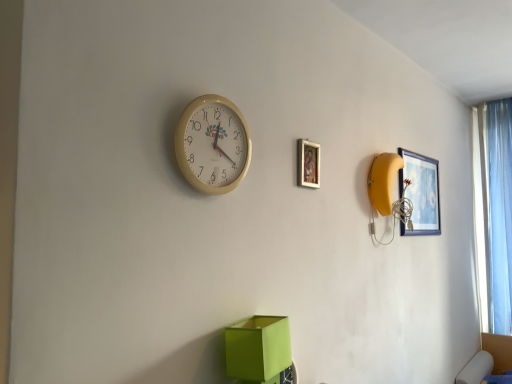
Question: Does wooden picture frame at upper center, the 2th picture frame positioned from the right, appear on the left side of light blue sheer curtain at right?

Choices:
 (A) yes
 (B) no

Answer: (A)

Question: Considering the relative sizes of wooden picture frame at upper center, marked as the 1th picture frame in a front-to-back arrangement, and light blue sheer curtain at right in the image provided, is wooden picture frame at upper center, marked as the 1th picture frame in a front-to-back arrangement, shorter than light blue sheer curtain at right?

Choices:
 (A) no
 (B) yes

Answer: (B)

Question: Considering the relative sizes of wooden picture frame at upper center, marked as the 1th picture frame in a left-to-right arrangement, and light blue sheer curtain at right in the image provided, is wooden picture frame at upper center, marked as the 1th picture frame in a left-to-right arrangement, taller than light blue sheer curtain at right?

Choices:
 (A) no
 (B) yes

Answer: (A)

Question: From a real-world perspective, does wooden picture frame at upper center, the 2th picture frame positioned from the right, sit lower than light blue sheer curtain at right?

Choices:
 (A) no
 (B) yes

Answer: (A)

Question: Is wooden picture frame at upper center, marked as the 1th picture frame in a left-to-right arrangement, positioned beyond the bounds of light blue sheer curtain at right?

Choices:
 (A) no
 (B) yes

Answer: (B)

Question: Is wooden picture frame at upper center, marked as the 1th picture frame in a front-to-back arrangement, taller or shorter than matte blue picture frame at upper right, which is the first picture frame from right to left?

Choices:
 (A) short
 (B) tall

Answer: (A)

Question: In terms of size, does wooden picture frame at upper center, marked as the 1th picture frame in a front-to-back arrangement, appear bigger or smaller than matte blue picture frame at upper right, which is the first picture frame from right to left?

Choices:
 (A) small
 (B) big

Answer: (A)

Question: Is point (308, 180) positioned closer to the camera than point (436, 160)?

Choices:
 (A) farther
 (B) closer

Answer: (B)

Question: Is wooden picture frame at upper center, positioned as the second picture frame in back-to-front order, situated inside matte blue picture frame at upper right, which is the first picture frame from right to left, or outside?

Choices:
 (A) outside
 (B) inside

Answer: (A)

Question: Looking at their shapes, would you say matte blue picture frame at upper right, which is the 1th picture frame in back-to-front order, is wider or thinner than beige plastic wall clock at upper center?

Choices:
 (A) wide
 (B) thin

Answer: (B)

Question: Would you say matte blue picture frame at upper right, the 2th picture frame from the left, is inside or outside beige plastic wall clock at upper center?

Choices:
 (A) outside
 (B) inside

Answer: (A)

Question: Considering the positions of point (419, 205) and point (223, 130), is point (419, 205) closer or farther from the camera than point (223, 130)?

Choices:
 (A) farther
 (B) closer

Answer: (A)

Question: From the image's perspective, is matte blue picture frame at upper right, which is the first picture frame from right to left, positioned above or below beige plastic wall clock at upper center?

Choices:
 (A) above
 (B) below

Answer: (B)

Question: In the image, is wooden picture frame at upper center, positioned as the second picture frame in back-to-front order, on the left side or the right side of beige plastic wall clock at upper center?

Choices:
 (A) left
 (B) right

Answer: (B)

Question: Looking at their shapes, would you say wooden picture frame at upper center, marked as the 1th picture frame in a left-to-right arrangement, is wider or thinner than beige plastic wall clock at upper center?

Choices:
 (A) thin
 (B) wide

Answer: (A)